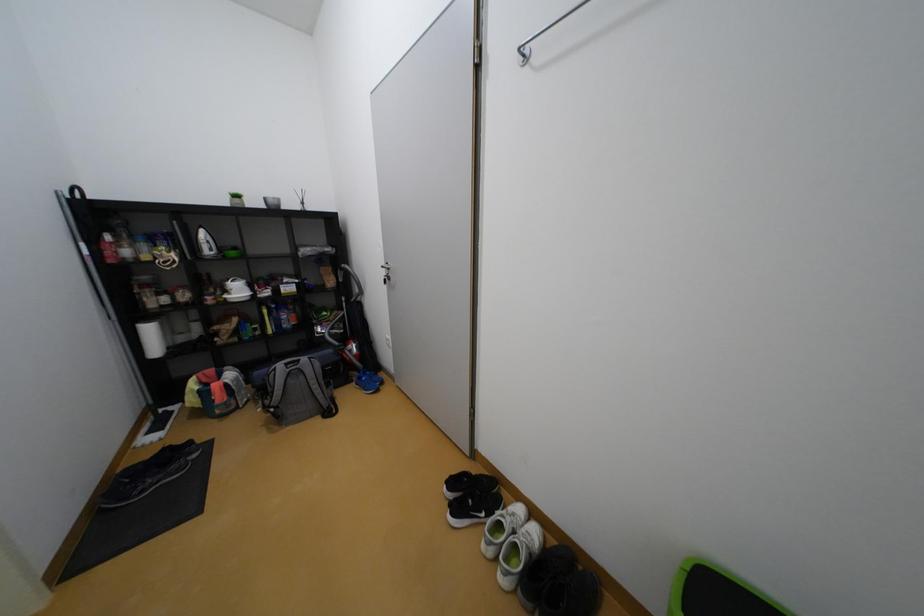
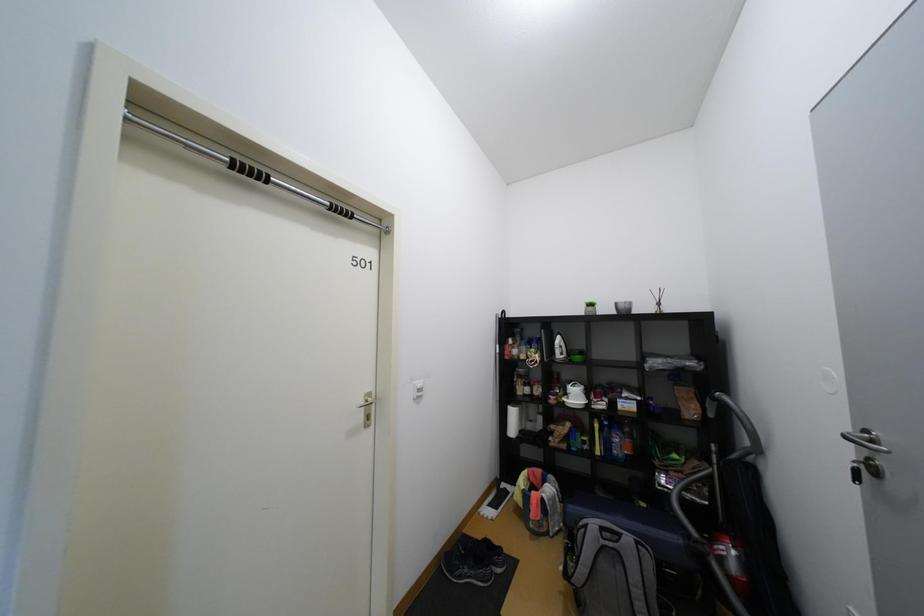
Question: How did the camera likely rotate?

Choices:
 (A) Left
 (B) Right
 (C) Up
 (D) Down

Answer: (A)